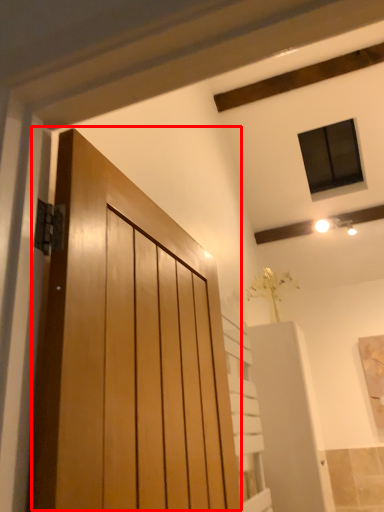
Question: From the image's perspective, considering the relative positions of door (annotated by the red box) and elevator in the image provided, where is door (annotated by the red box) located with respect to the staircase?

Choices:
 (A) above
 (B) below

Answer: (A)